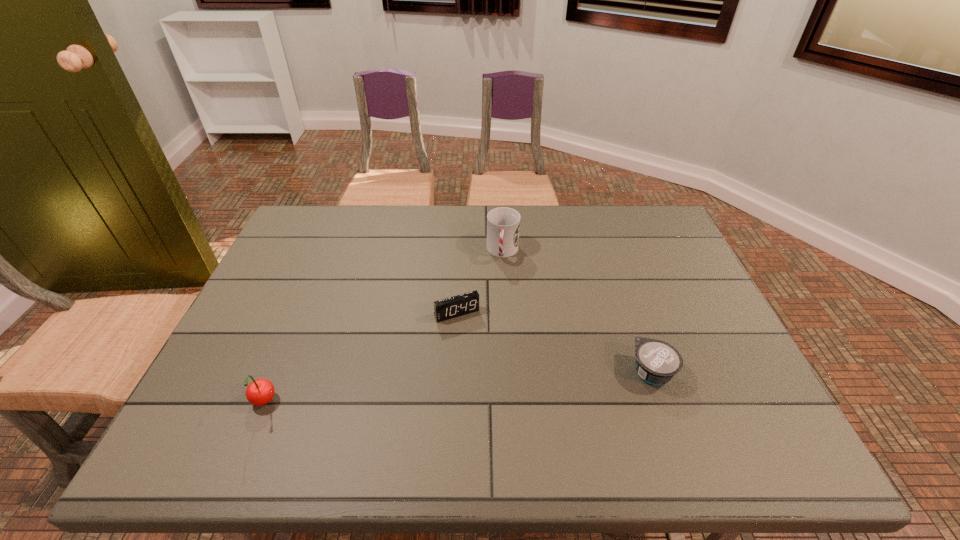
The width and height of the screenshot is (960, 540). What are the coordinates of `vacant point located 0.190m on the handle side of the farthest object` in the screenshot? It's located at (496, 313).

Identify the location of vacant area located on the front-facing side of the alarm clock. Image resolution: width=960 pixels, height=540 pixels. (477, 348).

This screenshot has height=540, width=960. Identify the location of free location located on the front-facing side of the alarm clock. (505, 404).

Locate an element on the screen. The width and height of the screenshot is (960, 540). vacant space located 0.220m on the front-facing side of the alarm clock is located at coordinates (498, 390).

Find the location of a particular element. object present at the far edge is located at coordinates (503, 224).

You are a GUI agent. You are given a task and a screenshot of the screen. Output one action in this format:
    pyautogui.click(x=<x>, y=<y>)
    Task: Click on the cherry located in the near edge section of the desktop
    This screenshot has width=960, height=540.
    Given the screenshot: What is the action you would take?
    pyautogui.click(x=259, y=392)

I want to click on yogurt positioned at the near edge, so click(657, 362).

Identify the location of object that is at the left edge. (259, 392).

The width and height of the screenshot is (960, 540). Identify the location of object that is at the near left corner. (259, 392).

The width and height of the screenshot is (960, 540). In order to click on vacant position at the far edge of the desktop in this screenshot , I will do `click(391, 208)`.